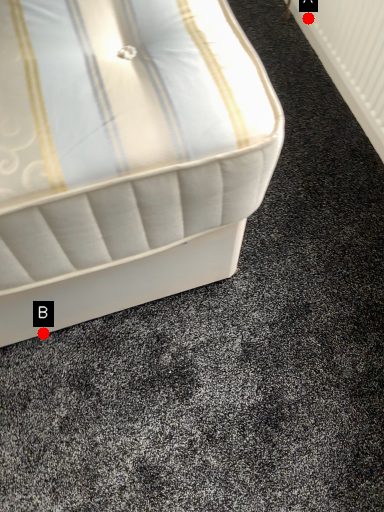
Question: Two points are circled on the image, labeled by A and B beside each circle. Which point is further to the camera?

Choices:
 (A) A is further
 (B) B is further

Answer: (A)